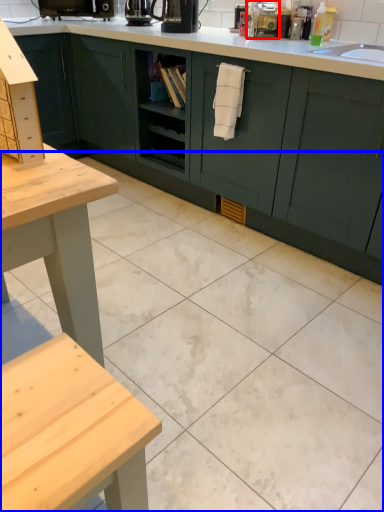
Question: Among these objects, which one is nearest to the camera, appliance (highlighted by a red box) or ceramic tile (highlighted by a blue box)?

Choices:
 (A) appliance
 (B) ceramic tile

Answer: (B)